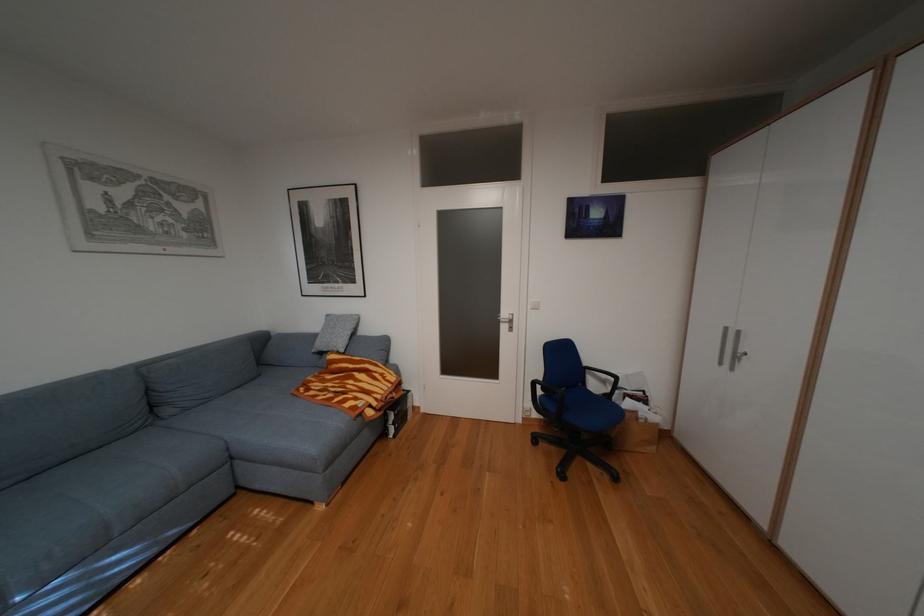
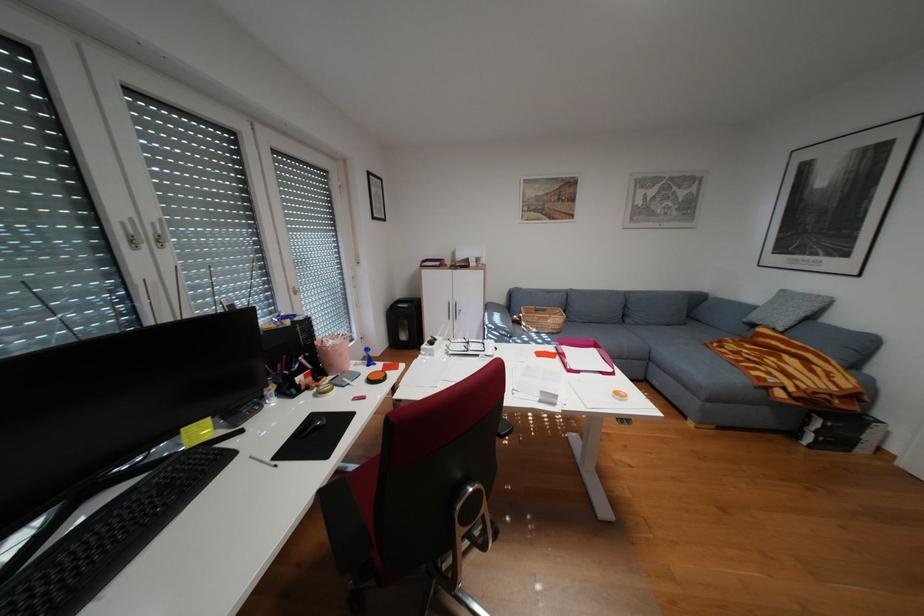
The point at (369, 398) is marked in the first image. Where is the corresponding point in the second image?

(782, 373)